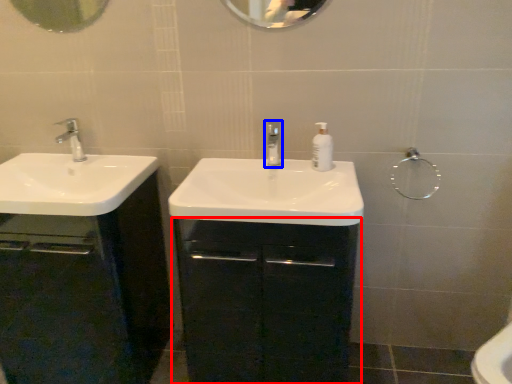
Question: Which point is closer to the camera, bathroom cabinet (highlighted by a red box) or tap (highlighted by a blue box)?

Choices:
 (A) bathroom cabinet
 (B) tap

Answer: (A)